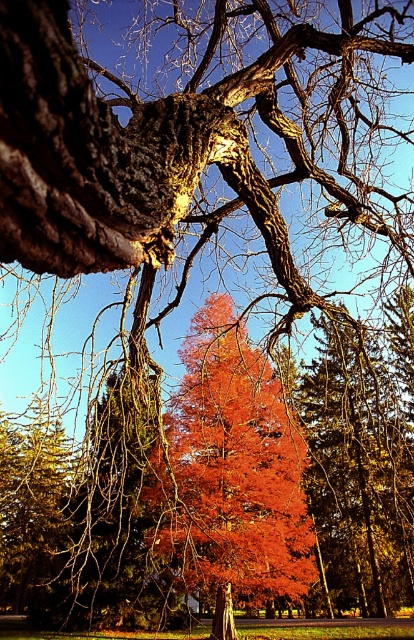
Question: Is vivid orange leaves at center positioned behind smooth bark tree trunk at center?

Choices:
 (A) no
 (B) yes

Answer: (A)

Question: Can you confirm if vivid orange leaves at center is positioned below smooth bark tree trunk at center?

Choices:
 (A) no
 (B) yes

Answer: (A)

Question: Which object is closer to the camera taking this photo?

Choices:
 (A) vivid orange leaves at center
 (B) smooth bark tree trunk at center

Answer: (A)

Question: Is vivid orange leaves at center to the left of smooth bark tree trunk at center from the viewer's perspective?

Choices:
 (A) no
 (B) yes

Answer: (B)

Question: Which object is closer to the camera taking this photo?

Choices:
 (A) smooth bark tree trunk at center
 (B) vivid orange leaves at center

Answer: (B)